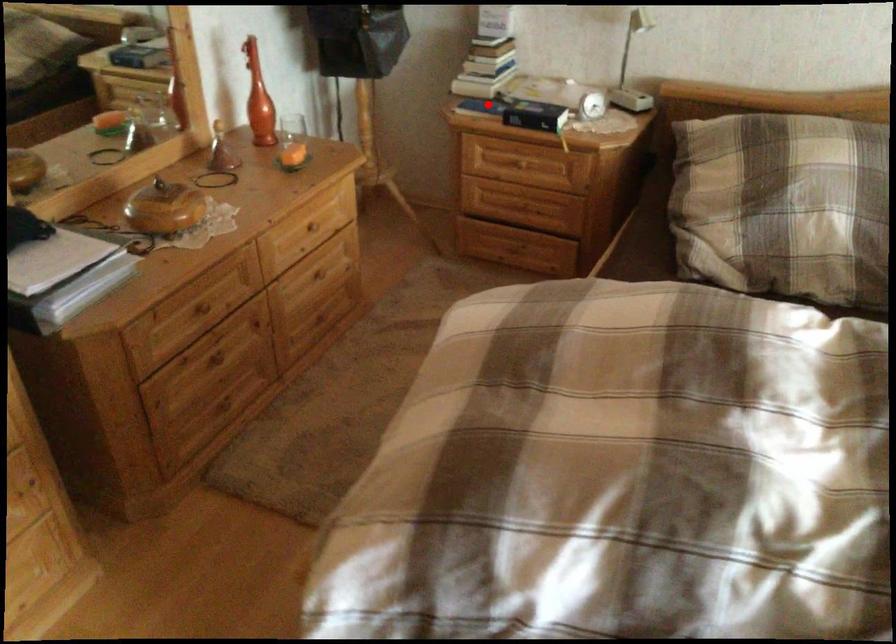
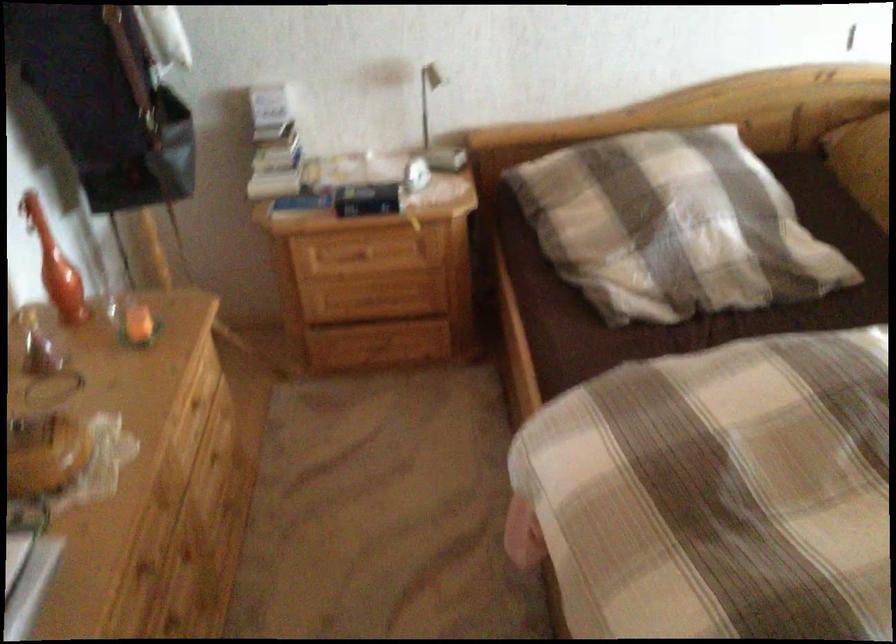
In the second image, find the point that corresponds to the highlighted location in the first image.

(304, 202)